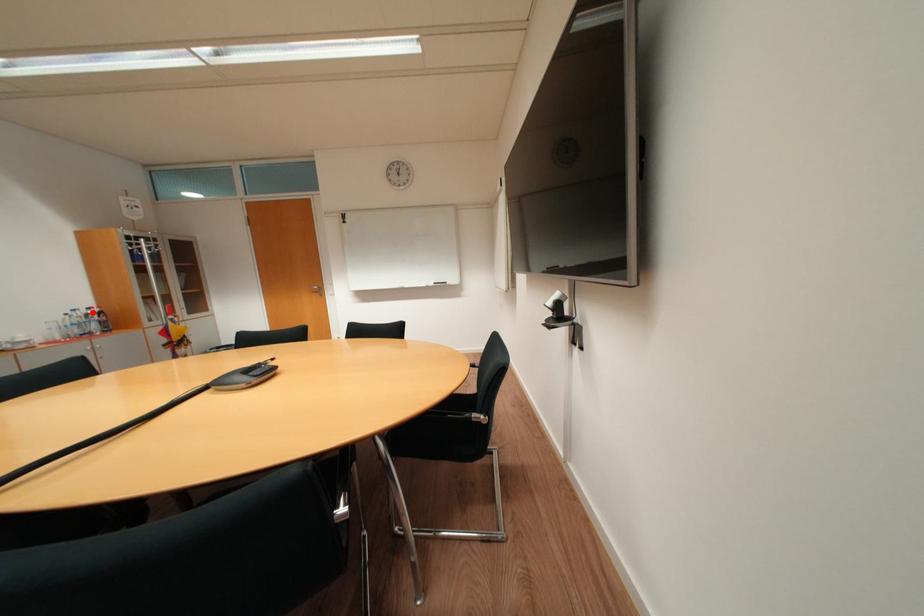
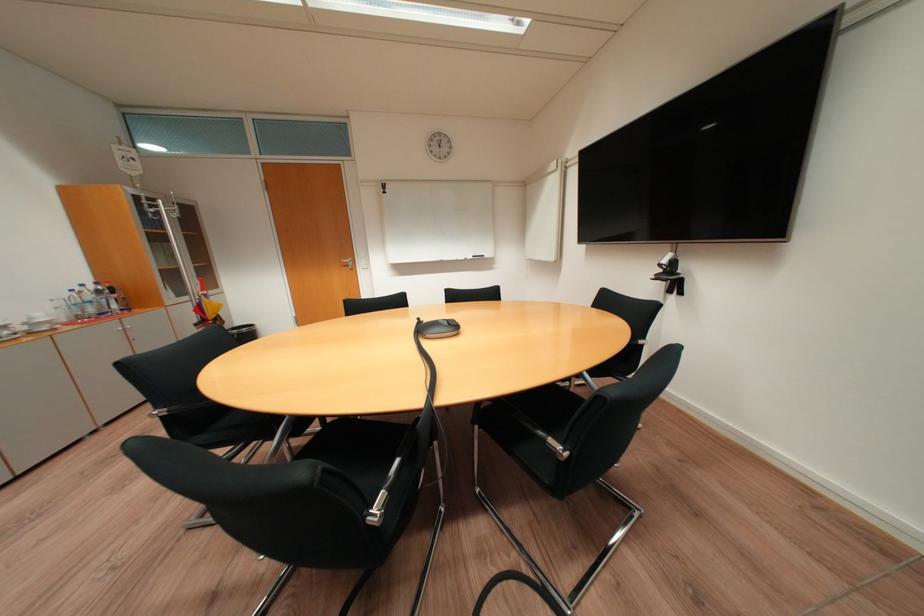
The point at the highlighted location is marked in the first image. Where is the corresponding point in the second image?

(101, 288)